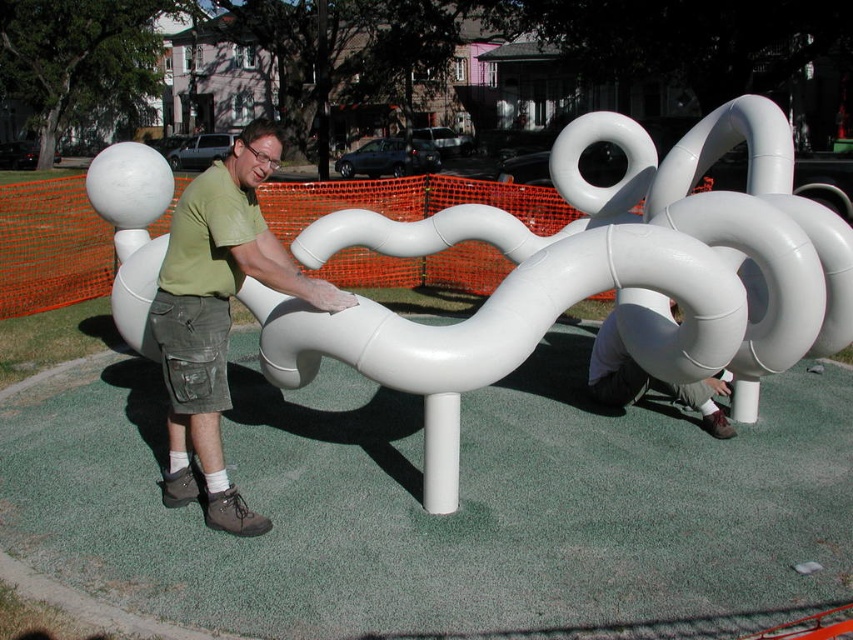
You are a visitor at the park and see the green matte shirt at center and the white matte tube at lower center. Which object is taller?

The green matte shirt at center is much taller than the white matte tube at lower center.

You are standing at the point marked as point (189,326) in the image. The sculpture is in front of you. If you walk straight ahead for 3 meters, will you hit the sculpture?

The distance between you and the point (189,326) is 3.19 meters. Since you are at the point, walking straight for 3 meters would leave you 0.19 meters short of the sculpture, so you would not hit it.